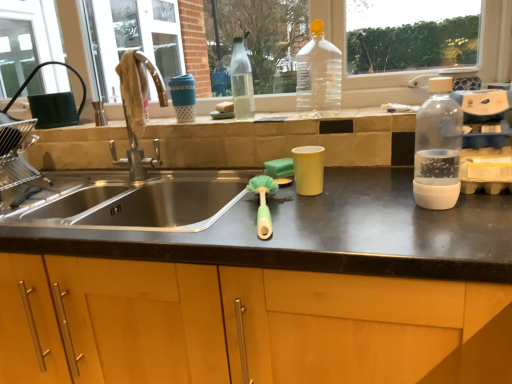
Question: Considering the relative sizes of transparent plastic bottle at right, the first bottle from the right, and green rubber brush at center in the image provided, is transparent plastic bottle at right, the first bottle from the right, bigger than green rubber brush at center?

Choices:
 (A) no
 (B) yes

Answer: (B)

Question: Can you confirm if transparent plastic bottle at right, which is the third bottle from back to front, is taller than green rubber brush at center?

Choices:
 (A) yes
 (B) no

Answer: (A)

Question: From the image's perspective, would you say transparent plastic bottle at right, the first bottle from the front, is positioned over green rubber brush at center?

Choices:
 (A) no
 (B) yes

Answer: (B)

Question: Considering the relative positions of transparent plastic bottle at right, the first bottle from the right, and green rubber brush at center in the image provided, is transparent plastic bottle at right, the first bottle from the right, to the right of green rubber brush at center from the viewer's perspective?

Choices:
 (A) no
 (B) yes

Answer: (B)

Question: Is transparent plastic bottle at right, acting as the third bottle starting from the left, thinner than green rubber brush at center?

Choices:
 (A) no
 (B) yes

Answer: (B)

Question: From a real-world perspective, is transparent plastic bottle at right, which is the third bottle from back to front, physically located above or below wooden cabinet at center?

Choices:
 (A) above
 (B) below

Answer: (A)

Question: In terms of height, does transparent plastic bottle at right, which is the third bottle from back to front, look taller or shorter compared to wooden cabinet at center?

Choices:
 (A) tall
 (B) short

Answer: (B)

Question: From the image's perspective, is transparent plastic bottle at right, which is the third bottle from back to front, positioned above or below wooden cabinet at center?

Choices:
 (A) above
 (B) below

Answer: (A)

Question: Is transparent plastic bottle at right, which is the third bottle from back to front, inside the boundaries of wooden cabinet at center, or outside?

Choices:
 (A) outside
 (B) inside

Answer: (A)

Question: Based on their sizes in the image, would you say transparent plastic bottle at center, positioned as the third bottle in right-to-left order, is bigger or smaller than transparent plastic bottle at right, acting as the third bottle starting from the left?

Choices:
 (A) small
 (B) big

Answer: (A)

Question: In the image, is transparent plastic bottle at center, acting as the third bottle starting from the front, positioned in front of or behind transparent plastic bottle at right, the first bottle from the front?

Choices:
 (A) front
 (B) behind

Answer: (B)

Question: Would you say transparent plastic bottle at center, positioned as the third bottle in right-to-left order, is inside or outside transparent plastic bottle at right, the first bottle from the right?

Choices:
 (A) inside
 (B) outside

Answer: (B)

Question: Is transparent plastic bottle at center, the 1th bottle positioned from the left, to the left or to the right of transparent plastic bottle at right, acting as the third bottle starting from the left, in the image?

Choices:
 (A) right
 (B) left

Answer: (B)

Question: From a real-world perspective, is green sponge at center above or below wooden cabinet at center?

Choices:
 (A) below
 (B) above

Answer: (B)

Question: Is point (285, 173) closer or farther from the camera than point (135, 314)?

Choices:
 (A) closer
 (B) farther

Answer: (B)